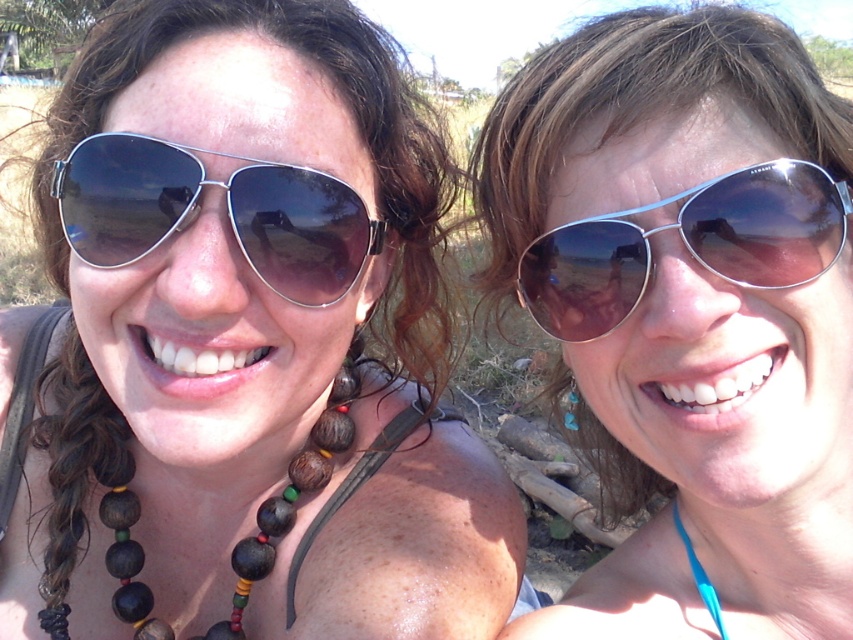
You are a photographer trying to capture the reflection in the metallic aviator sunglasses at center and the wooden beads at left. Which object is positioned to the left of the other?

The wooden beads at left are to the left of the metallic aviator sunglasses at center.

You are standing in front of the image and want to locate the metallic aviator sunglasses at center. What are their coordinates?

The metallic aviator sunglasses at center are located at coordinates point (688, 314).

Looking at this image, you are a photographer trying to capture the scene. You notice a point marked at coordinates [248,340]. What object is located at this point?

The point at coordinates [248,340] marks the matte black sunglasses at upper left.